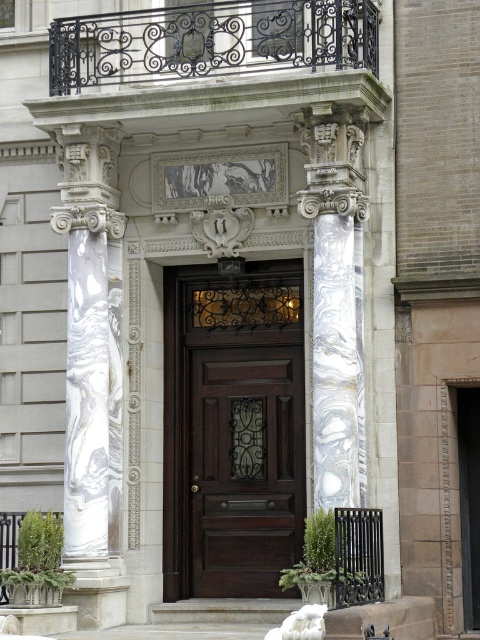
Consider the image. Who is higher up, dark wood door at center or white marble stairs at center?

dark wood door at center is higher up.

Does dark wood door at center have a lesser width compared to white marble stairs at center?

Yes.

Who is more distant from viewer, [220,445] or [211,605]?

Point [220,445]

You are a GUI agent. You are given a task and a screenshot of the screen. Output one action in this format:
    pyautogui.click(x=<x>, y=<y>)
    Task: Click on the dark wood door at center
    The height and width of the screenshot is (640, 480).
    Given the screenshot: What is the action you would take?
    pyautogui.click(x=244, y=468)